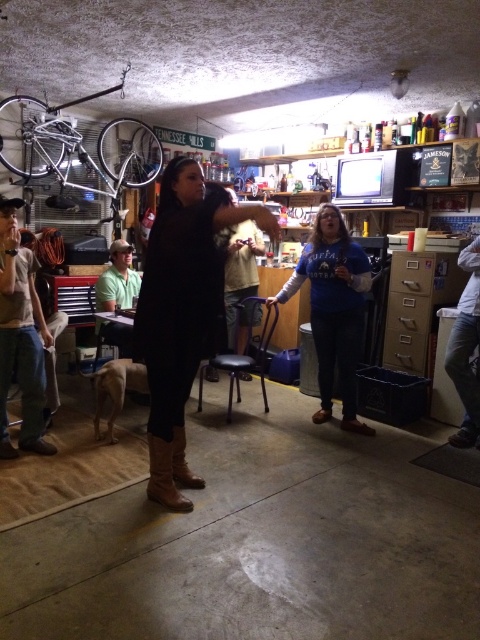
Question: Based on their relative distances, which object is nearer to the brown suede boot at center?

Choices:
 (A) matte black coat at center
 (B) blue cotton shirt at center
 (C) fuzzy beige sweater at center
 (D) brushed metal shirt at left

Answer: (A)

Question: Which point is farther to the camera?

Choices:
 (A) (350, 317)
 (B) (27, 369)
 (C) (132, 300)
 (D) (249, 241)

Answer: (D)

Question: Which object is closer to the camera taking this photo?

Choices:
 (A) matte black coat at center
 (B) brushed metal shirt at left
 (C) fuzzy beige sweater at center

Answer: (A)

Question: Can you confirm if blue cotton shirt at center is positioned below green shirt at left?

Choices:
 (A) no
 (B) yes

Answer: (B)

Question: Does fuzzy beige sweater at center have a greater width compared to green shirt at left?

Choices:
 (A) no
 (B) yes

Answer: (A)

Question: Is blue cotton shirt at center closer to the viewer compared to brown leather boot at center?

Choices:
 (A) yes
 (B) no

Answer: (B)